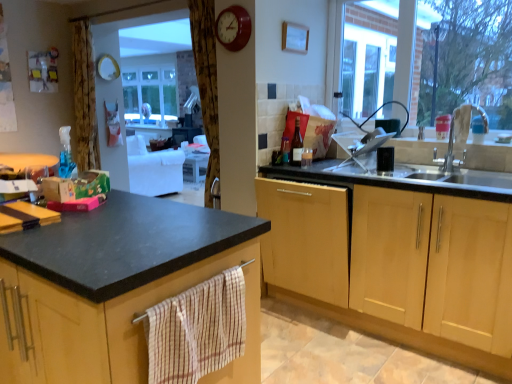
Question: Considering their positions, is white matte tap at right located in front of or behind metallic sink at right?

Choices:
 (A) front
 (B) behind

Answer: (B)

Question: Considering the positions of white matte tap at right and metallic sink at right in the image, is white matte tap at right wider or thinner than metallic sink at right?

Choices:
 (A) wide
 (B) thin

Answer: (B)

Question: Which is farther from the metallic sink at right?

Choices:
 (A) matte red clock at upper center
 (B) matte black countertop at left, the 1th cabinetry in the left-to-right sequence
 (C) brown textured curtain at upper center
 (D) white matte tap at right
 (E) light wood cabinet at center, the first cabinetry from the right

Answer: (B)

Question: Which object is the closest to the matte red clock at upper center?

Choices:
 (A) metallic sink at right
 (B) light wood cabinet at center, the first cabinetry from the right
 (C) white matte tap at right
 (D) brown textured curtain at upper center
 (E) matte black countertop at left, the 2th cabinetry viewed from the right

Answer: (D)